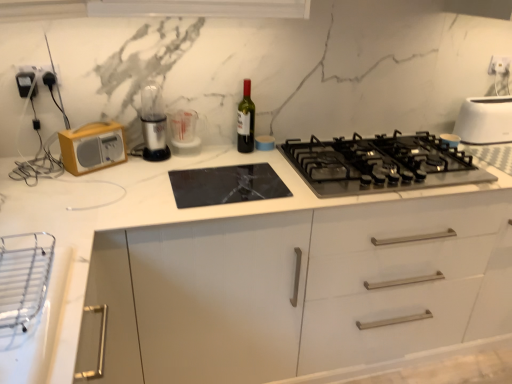
Question: Does white plastic toaster at upper right appear on the left side of clear plastic measuring cup at center, arranged as the first appliance when ordered from the bottom?

Choices:
 (A) yes
 (B) no

Answer: (B)

Question: Does white plastic toaster at upper right have a lesser width compared to clear plastic measuring cup at center, acting as the second appliance starting from the top?

Choices:
 (A) yes
 (B) no

Answer: (B)

Question: From the image's perspective, is white plastic toaster at upper right below clear plastic measuring cup at center, the second appliance in the front-to-back sequence?

Choices:
 (A) no
 (B) yes

Answer: (A)

Question: Is white plastic toaster at upper right next to clear plastic measuring cup at center, acting as the second appliance starting from the top, and touching it?

Choices:
 (A) yes
 (B) no

Answer: (B)

Question: Can we say white plastic toaster at upper right lies outside clear plastic measuring cup at center, acting as the second appliance starting from the top?

Choices:
 (A) yes
 (B) no

Answer: (A)

Question: Is matte black radio at left, arranged as the 2th appliance when ordered from the bottom, to the left or to the right of white plastic toaster at upper right in the image?

Choices:
 (A) left
 (B) right

Answer: (A)

Question: From the image's perspective, is matte black radio at left, arranged as the 2th appliance when ordered from the bottom, positioned above or below white plastic toaster at upper right?

Choices:
 (A) above
 (B) below

Answer: (A)

Question: Is matte black radio at left, which is the second appliance from right to left, wider or thinner than white plastic toaster at upper right?

Choices:
 (A) wide
 (B) thin

Answer: (B)

Question: Considering the positions of matte black radio at left, arranged as the first appliance when viewed from the left, and white plastic toaster at upper right in the image, is matte black radio at left, arranged as the first appliance when viewed from the left, bigger or smaller than white plastic toaster at upper right?

Choices:
 (A) small
 (B) big

Answer: (A)

Question: Is point (430, 178) positioned closer to the camera than point (498, 125)?

Choices:
 (A) closer
 (B) farther

Answer: (A)

Question: Considering their positions, is black matte gas stove at center located in front of or behind white plastic toaster at upper right?

Choices:
 (A) behind
 (B) front

Answer: (B)

Question: In terms of size, does black matte gas stove at center appear bigger or smaller than white plastic toaster at upper right?

Choices:
 (A) big
 (B) small

Answer: (A)

Question: From the image's perspective, is black matte gas stove at center positioned above or below white plastic toaster at upper right?

Choices:
 (A) above
 (B) below

Answer: (B)

Question: Is black matte gas stove at center to the left or to the right of white plastic electrical outlet at upper right in the image?

Choices:
 (A) right
 (B) left

Answer: (B)

Question: Considering the positions of black matte gas stove at center and white plastic electrical outlet at upper right in the image, is black matte gas stove at center taller or shorter than white plastic electrical outlet at upper right?

Choices:
 (A) short
 (B) tall

Answer: (A)